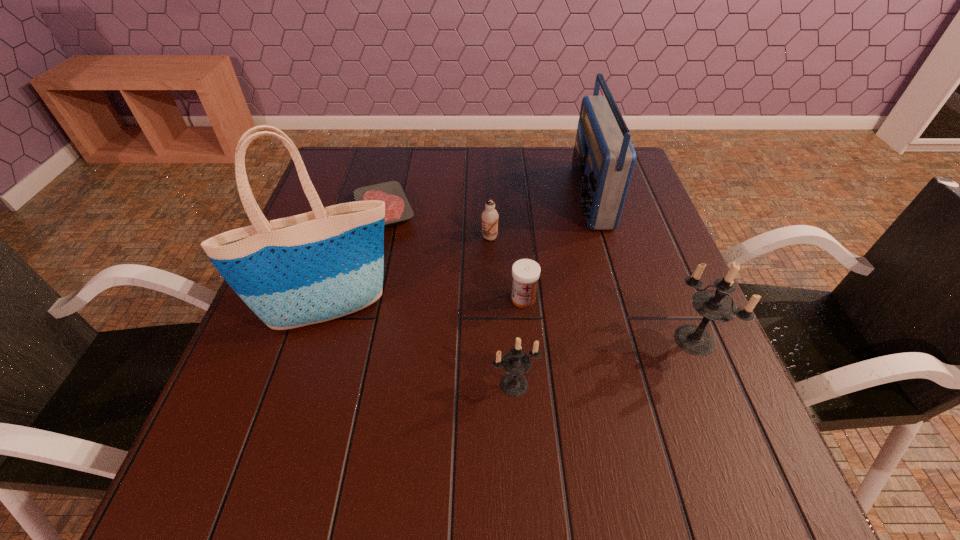
This screenshot has width=960, height=540. Find the location of `the nearest object`. the nearest object is located at coordinates (516, 362).

Image resolution: width=960 pixels, height=540 pixels. Identify the location of the shorter candle holder. coord(516,362).

The image size is (960, 540). What are the coordinates of `the rightmost object` in the screenshot? It's located at (713, 305).

This screenshot has height=540, width=960. I want to click on the farther candle holder, so click(x=713, y=305).

The image size is (960, 540). I want to click on medicine, so click(525, 272).

The image size is (960, 540). I want to click on radio receiver, so click(603, 161).

Identify the location of the second object from right to left. (603, 161).

What are the coordinates of `steak` in the screenshot? It's located at click(398, 209).

This screenshot has height=540, width=960. What are the coordinates of `the tallest object` in the screenshot? It's located at (291, 272).

The height and width of the screenshot is (540, 960). I want to click on chocolate milk, so click(490, 216).